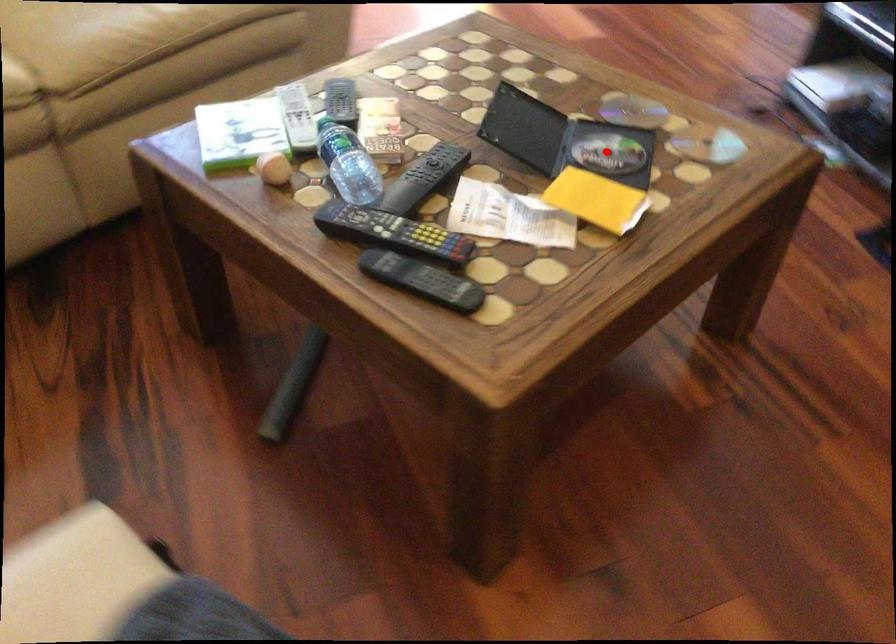
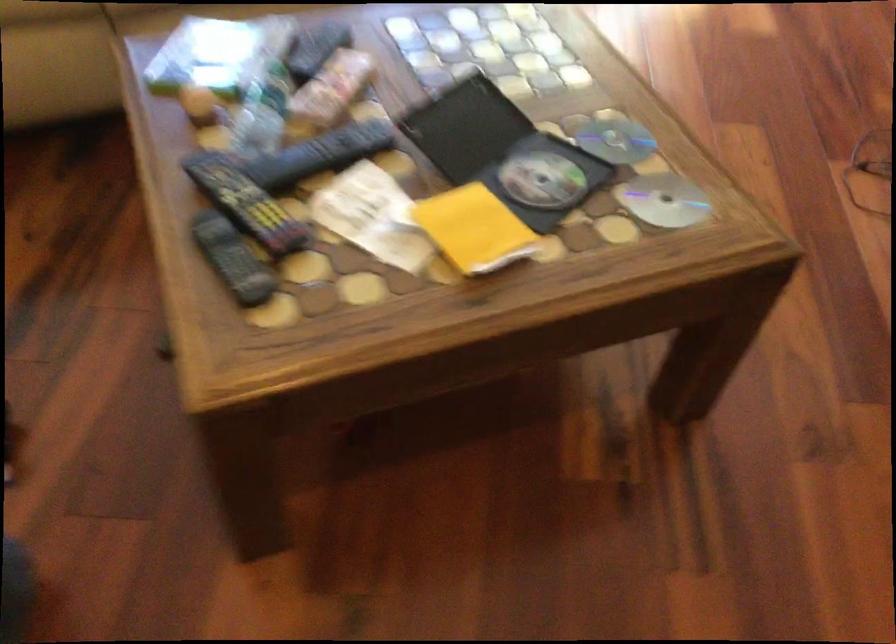
Question: A red point is marked in image1. In image2, is the corresponding 3D point closer to the camera or farther? Reply with the corresponding letter.

Choices:
 (A) The corresponding 3D point is closer.
 (B) The corresponding 3D point is farther.

Answer: (A)